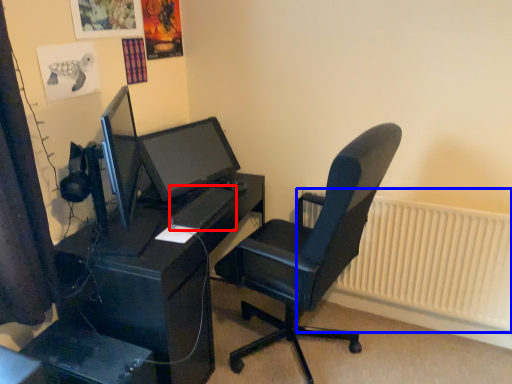
Question: Among these objects, which one is farthest to the camera, keyboard (highlighted by a red box) or radiator (highlighted by a blue box)?

Choices:
 (A) keyboard
 (B) radiator

Answer: (B)